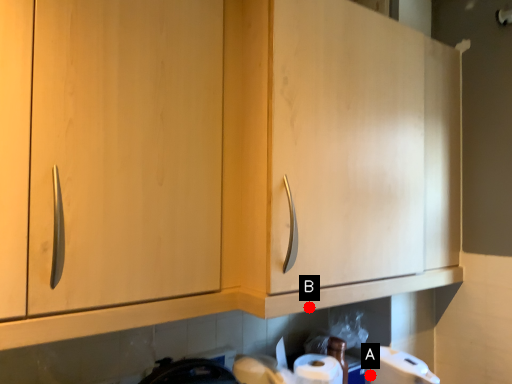
Question: Two points are circled on the image, labeled by A and B beside each circle. Which point is closer to the camera?

Choices:
 (A) A is closer
 (B) B is closer

Answer: (B)